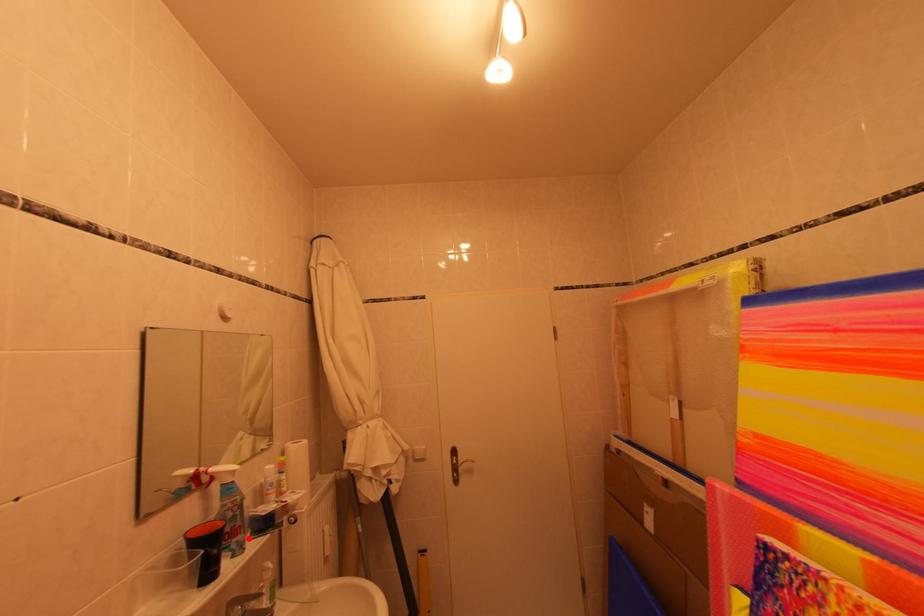
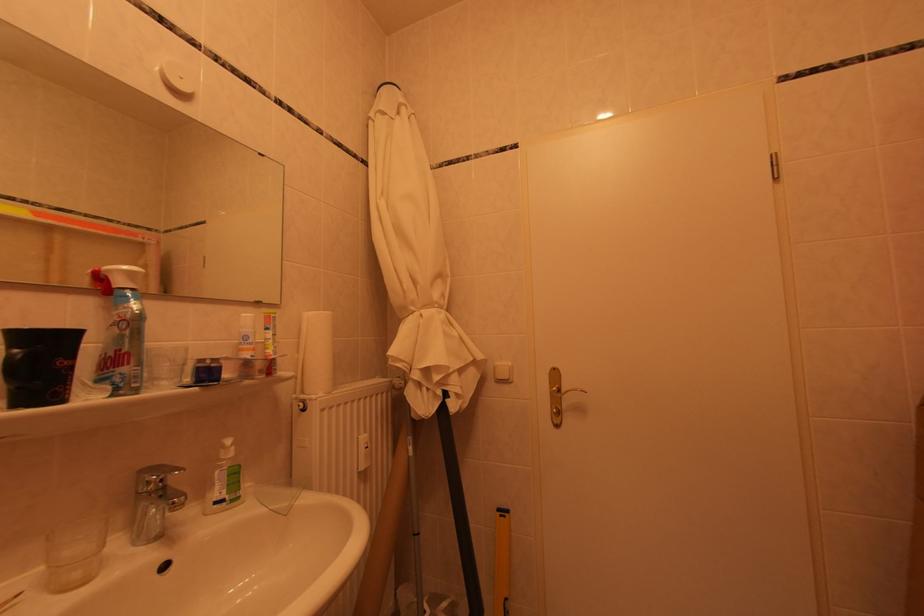
Locate, in the second image, the point that corresponds to the highlighted location in the first image.

(138, 368)